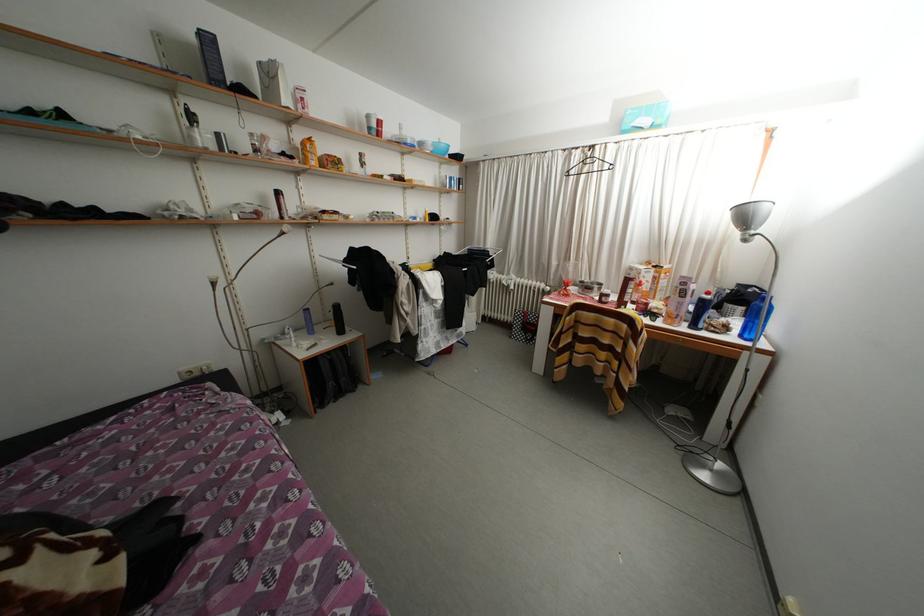
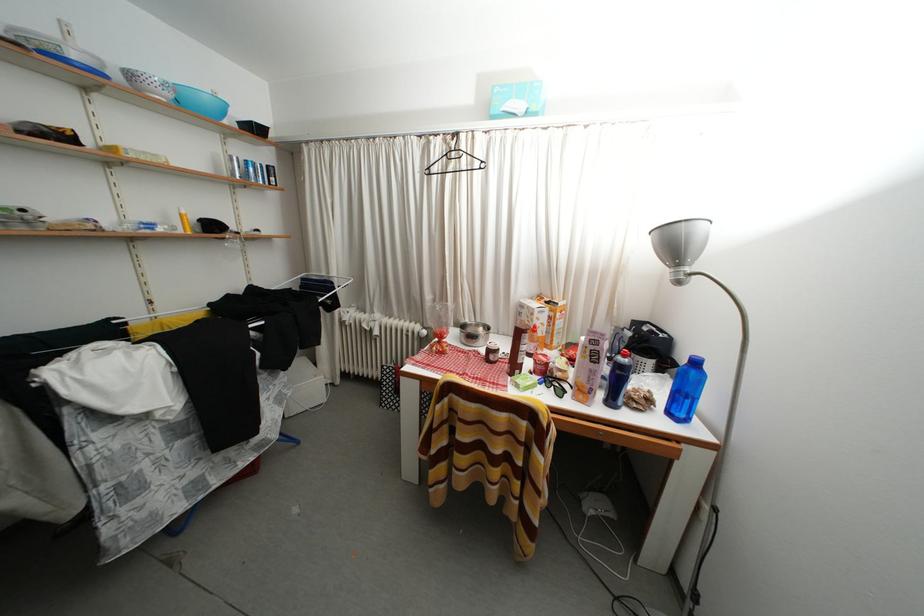
The point at [700,331] is marked in the first image. Where is the corresponding point in the second image?

(618, 408)